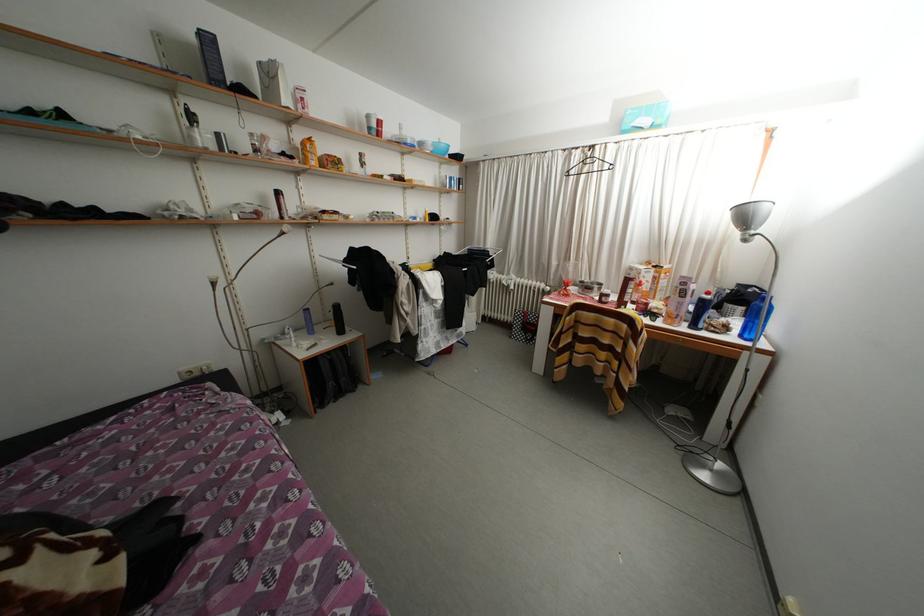
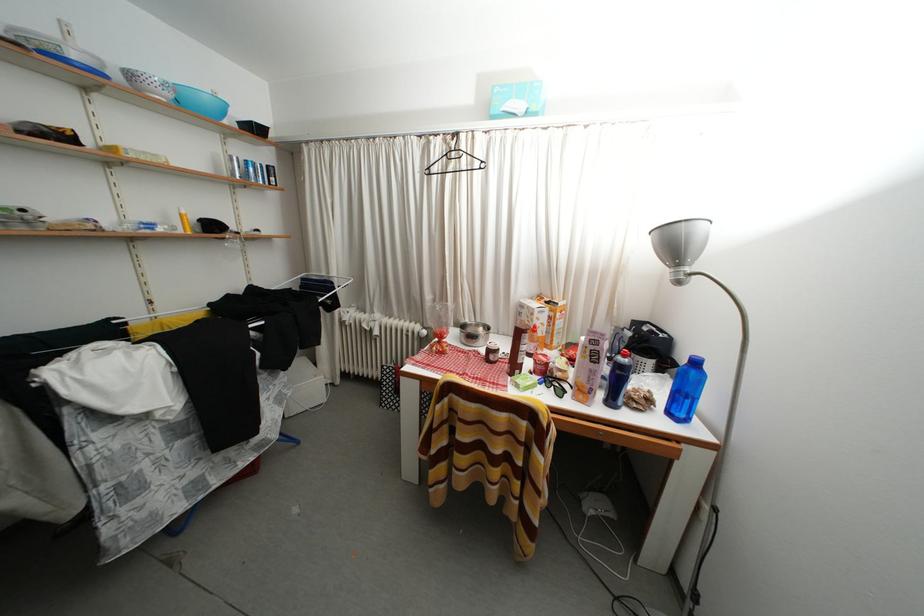
The point at [700,331] is marked in the first image. Where is the corresponding point in the second image?

(618, 408)